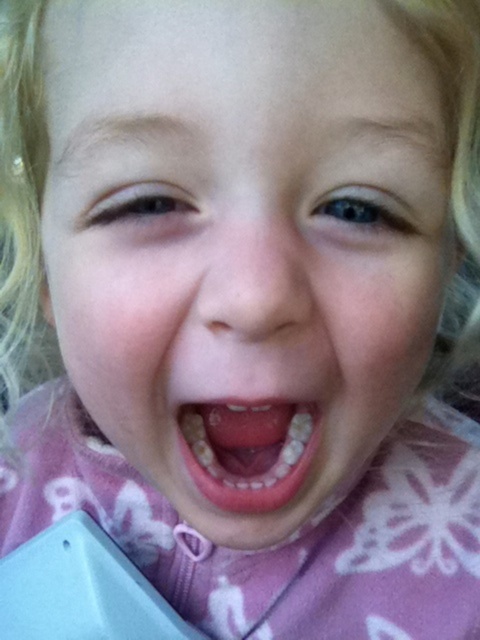
Question: Can you confirm if pink fabric face at center is wider than yellowish toothpaste at center?

Choices:
 (A) yes
 (B) no

Answer: (A)

Question: Considering the relative positions of pink fabric face at center and yellowish toothpaste at center in the image provided, where is pink fabric face at center located with respect to yellowish toothpaste at center?

Choices:
 (A) below
 (B) above

Answer: (B)

Question: Can you confirm if pink fabric face at center is positioned to the left of yellowish toothpaste at center?

Choices:
 (A) yes
 (B) no

Answer: (B)

Question: Which object appears closest to the camera in this image?

Choices:
 (A) pink fabric face at center
 (B) yellowish toothpaste at center

Answer: (A)

Question: Which object is closer to the camera taking this photo?

Choices:
 (A) yellowish toothpaste at center
 (B) pink fabric face at center

Answer: (B)

Question: Which point is closer to the camera taking this photo?

Choices:
 (A) coord(300,483)
 (B) coord(324,148)

Answer: (B)